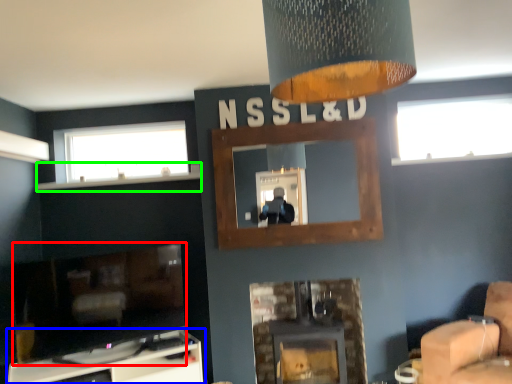
Question: Based on their relative distances, which object is nearer to fireplace (highlighted by a red box)? Choose from furniture (highlighted by a blue box) and mantle (highlighted by a green box).

Choices:
 (A) furniture
 (B) mantle

Answer: (A)